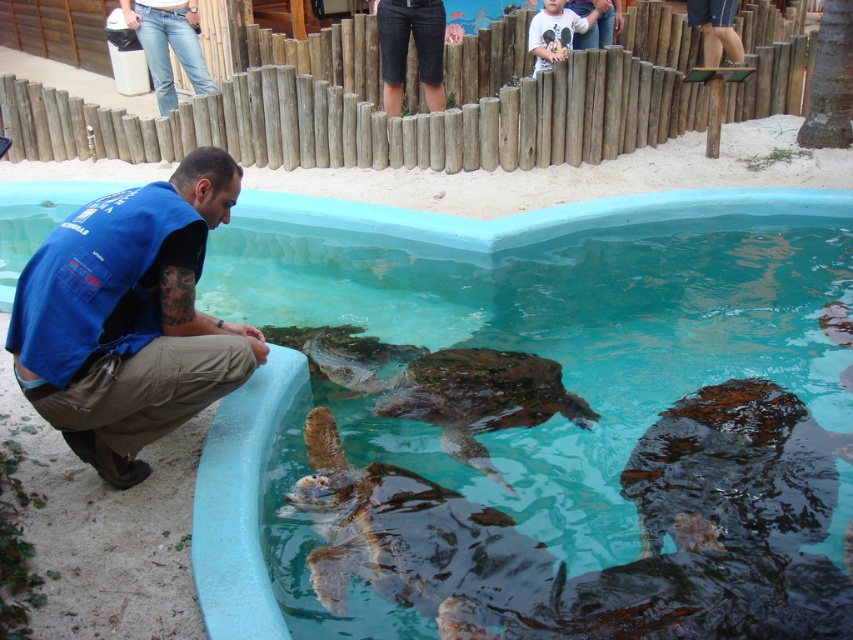
Question: Which object is positioned farthest from the smooth concrete pool at center?

Choices:
 (A) brown rough textured tortoise at center
 (B) blue fabric vest at lower left
 (C) brown rough tortoise at center
 (D) jeans at center

Answer: (D)

Question: Which point appears closest to the camera in this image?

Choices:
 (A) (328, 333)
 (B) (718, 637)
 (C) (155, 99)

Answer: (B)

Question: Is brown rough textured tortoise at center in front of dark blue shirt at upper right?

Choices:
 (A) no
 (B) yes

Answer: (B)

Question: Can you confirm if brown rough textured tortoise at center is positioned to the left of brown rough tortoise at center?

Choices:
 (A) yes
 (B) no

Answer: (B)

Question: Which point is farther from the camera taking this photo?

Choices:
 (A) (79, 282)
 (B) (247, 428)

Answer: (B)

Question: Can you confirm if blue fabric vest at lower left is positioned above jeans at center?

Choices:
 (A) no
 (B) yes

Answer: (A)